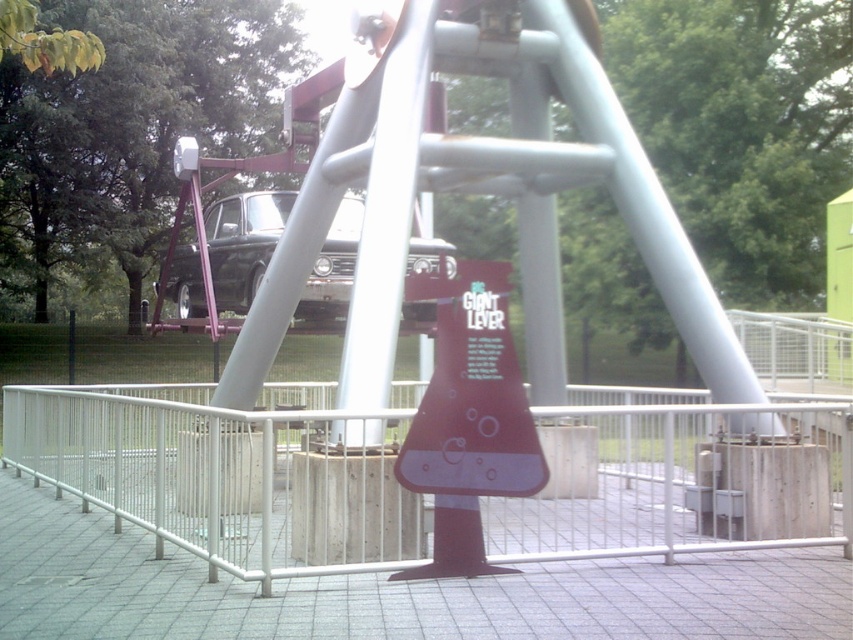
You are standing at point (x=454, y=460) and want to walk to point (x=751, y=484). Which direction should you move in?

Point (x=751, y=484) is behind point (x=454, y=460), so you should move in the backward direction to reach it.

You are a visitor at the exhibit and want to read the instructions on the matte purple sign at center. However, the shiny black car at center is blocking your view. Can you see the sign clearly?

The matte purple sign at center is below the shiny black car at center, so the car is blocking your view of the sign.

From the picture: You are standing in front of the Giant Lever exhibit and want to reach a point that is exactly 25 feet away from you. The point you need to reach is labeled as point (289, 545) in the image. Can you determine if this point is within your target distance range?

The distance of point (289, 545) from viewer is 24.50 feet, so yes, it is within the target distance range of 25 feet.